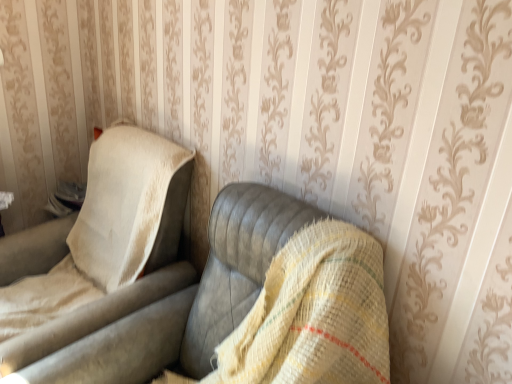
The height and width of the screenshot is (384, 512). What do you see at coordinates (169, 302) in the screenshot?
I see `leather-like gray couch at center` at bounding box center [169, 302].

Measure the distance between point (117, 330) and camera.

Point (117, 330) is 4.27 feet from camera.

The image size is (512, 384). I want to click on leather-like gray couch at center, so click(169, 302).

The width and height of the screenshot is (512, 384). I want to click on beige fabric chair at left, so click(x=94, y=246).

The width and height of the screenshot is (512, 384). What do you see at coordinates (94, 246) in the screenshot?
I see `beige fabric chair at left` at bounding box center [94, 246].

This screenshot has height=384, width=512. I want to click on leather-like gray couch at center, so click(x=169, y=302).

Considering the relative positions of beige fabric chair at left and leather-like gray couch at center in the image provided, is beige fabric chair at left to the right of leather-like gray couch at center from the viewer's perspective?

Incorrect, beige fabric chair at left is not on the right side of leather-like gray couch at center.

Between beige fabric chair at left and leather-like gray couch at center, which one is positioned behind?

Positioned behind is beige fabric chair at left.

Is point (2, 298) closer or farther from the camera than point (46, 342)?

Point (2, 298) appears to be farther away from the viewer than point (46, 342).

From the image's perspective, between beige fabric chair at left and leather-like gray couch at center, who is located below?

leather-like gray couch at center.

From a real-world perspective, is beige fabric chair at left beneath leather-like gray couch at center?

No, from a real-world perspective, beige fabric chair at left is not beneath leather-like gray couch at center.

Is beige fabric chair at left wider or thinner than leather-like gray couch at center?

Clearly, beige fabric chair at left has less width compared to leather-like gray couch at center.

Which of these two, beige fabric chair at left or leather-like gray couch at center, stands taller?

Standing taller between the two is leather-like gray couch at center.

Is beige fabric chair at left bigger than leather-like gray couch at center?

Yes.

Is beige fabric chair at left located outside leather-like gray couch at center?

Yes, beige fabric chair at left is located beyond the bounds of leather-like gray couch at center.

Is beige fabric chair at left directly adjacent to leather-like gray couch at center?

beige fabric chair at left is not next to leather-like gray couch at center, and they're not touching.

Is beige fabric chair at left turned away from leather-like gray couch at center?

No, beige fabric chair at left's orientation is not away from leather-like gray couch at center.

Locate an element on the screen. The image size is (512, 384). studio couch below the beige fabric chair at left (from the image's perspective) is located at coordinates (169, 302).

Is leather-like gray couch at center to the left or to the right of beige fabric chair at left in the image?

In the image, leather-like gray couch at center appears on the right side of beige fabric chair at left.

Consider the image. Is leather-like gray couch at center behind beige fabric chair at left?

No, it is in front of beige fabric chair at left.

Between point (260, 247) and point (105, 224), which one is positioned behind?

The point (105, 224) is behind.

From the image's perspective, which one is positioned lower, leather-like gray couch at center or beige fabric chair at left?

leather-like gray couch at center appears lower in the image.

From a real-world perspective, who is located lower, leather-like gray couch at center or beige fabric chair at left?

Answer: leather-like gray couch at center is physically lower.

Which of these two, leather-like gray couch at center or beige fabric chair at left, is thinner?

Thinner between the two is beige fabric chair at left.

Which of these two, leather-like gray couch at center or beige fabric chair at left, stands taller?

leather-like gray couch at center is taller.

Can you confirm if leather-like gray couch at center is smaller than beige fabric chair at left?

Yes.

Is leather-like gray couch at center not inside beige fabric chair at left?

Indeed, leather-like gray couch at center is completely outside beige fabric chair at left.

Is leather-like gray couch at center not close to beige fabric chair at left?

Actually, leather-like gray couch at center and beige fabric chair at left are a little close together.

Is leather-like gray couch at center aimed at beige fabric chair at left?

No, leather-like gray couch at center is not oriented towards beige fabric chair at left.

How far apart are leather-like gray couch at center and beige fabric chair at left?

leather-like gray couch at center is 11.24 inches from beige fabric chair at left.

Where is `studio couch beneath the beige fabric chair at left (from a real-world perspective)`? studio couch beneath the beige fabric chair at left (from a real-world perspective) is located at coordinates (169, 302).

Locate an element on the screen. Image resolution: width=512 pixels, height=384 pixels. chair behind the leather-like gray couch at center is located at coordinates (94, 246).

You are a GUI agent. You are given a task and a screenshot of the screen. Output one action in this format:
    pyautogui.click(x=<x>, y=<y>)
    Task: Click on the chair that is on the left side of leather-like gray couch at center
    
    Given the screenshot: What is the action you would take?
    pyautogui.click(x=94, y=246)